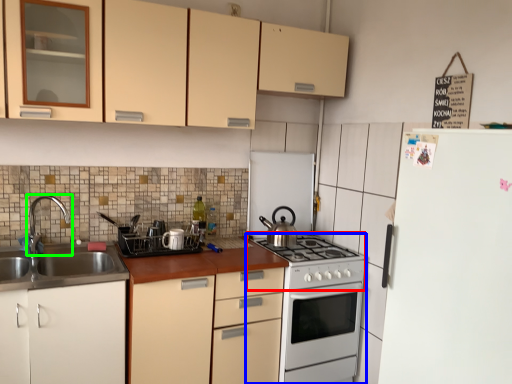
Question: Which object is the farthest from gas stove (highlighted by a red box)? Choose among these: oven (highlighted by a blue box) or tap (highlighted by a green box).

Choices:
 (A) oven
 (B) tap

Answer: (B)